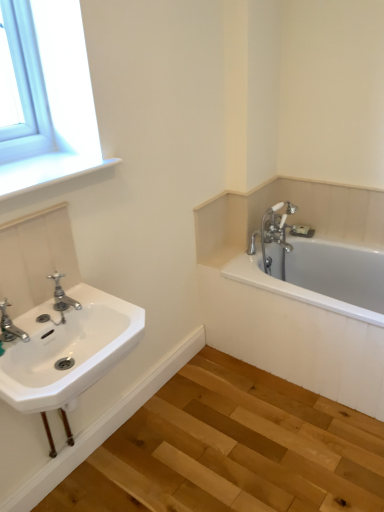
Question: Is white smooth window sill at upper left smaller than polished chrome faucet at left, the first tap from the right?

Choices:
 (A) no
 (B) yes

Answer: (A)

Question: From a real-world perspective, is white smooth window sill at upper left under polished chrome faucet at left, the first tap from the right?

Choices:
 (A) yes
 (B) no

Answer: (B)

Question: Is white smooth window sill at upper left at the left side of polished chrome faucet at left, the first tap from the right?

Choices:
 (A) no
 (B) yes

Answer: (B)

Question: Is white smooth window sill at upper left at the right side of polished chrome faucet at left, the 2th tap viewed from the front?

Choices:
 (A) no
 (B) yes

Answer: (A)

Question: Is white smooth window sill at upper left looking in the opposite direction of polished chrome faucet at left, which is the first tap in back-to-front order?

Choices:
 (A) yes
 (B) no

Answer: (B)

Question: In the image, is white smooth window sill at upper left on the left side or the right side of polished chrome faucet at left, the 2th tap viewed from the front?

Choices:
 (A) left
 (B) right

Answer: (A)

Question: Is point (56, 168) positioned closer to the camera than point (64, 298)?

Choices:
 (A) closer
 (B) farther

Answer: (A)

Question: In terms of height, does white smooth window sill at upper left look taller or shorter compared to polished chrome faucet at left, arranged as the second tap when viewed from the left?

Choices:
 (A) tall
 (B) short

Answer: (B)

Question: Looking at the image, does white smooth window sill at upper left seem bigger or smaller compared to polished chrome faucet at left, the 2th tap viewed from the front?

Choices:
 (A) big
 (B) small

Answer: (A)

Question: Is white smooth window sill at upper left in front of or behind brushed metal faucet at lower left, the 1th tap viewed from the front, in the image?

Choices:
 (A) behind
 (B) front

Answer: (A)

Question: In terms of size, does white smooth window sill at upper left appear bigger or smaller than brushed metal faucet at lower left, the 1th tap viewed from the front?

Choices:
 (A) big
 (B) small

Answer: (A)

Question: From a real-world perspective, is white smooth window sill at upper left above or below brushed metal faucet at lower left, the 1th tap viewed from the front?

Choices:
 (A) below
 (B) above

Answer: (B)

Question: In terms of width, does white smooth window sill at upper left look wider or thinner when compared to brushed metal faucet at lower left, the 1th tap viewed from the front?

Choices:
 (A) thin
 (B) wide

Answer: (B)

Question: Does point (9, 348) appear closer or farther from the camera than point (39, 157)?

Choices:
 (A) farther
 (B) closer

Answer: (B)

Question: From a real-world perspective, is white porcelain sink at left positioned above or below white smooth window sill at upper left?

Choices:
 (A) below
 (B) above

Answer: (A)